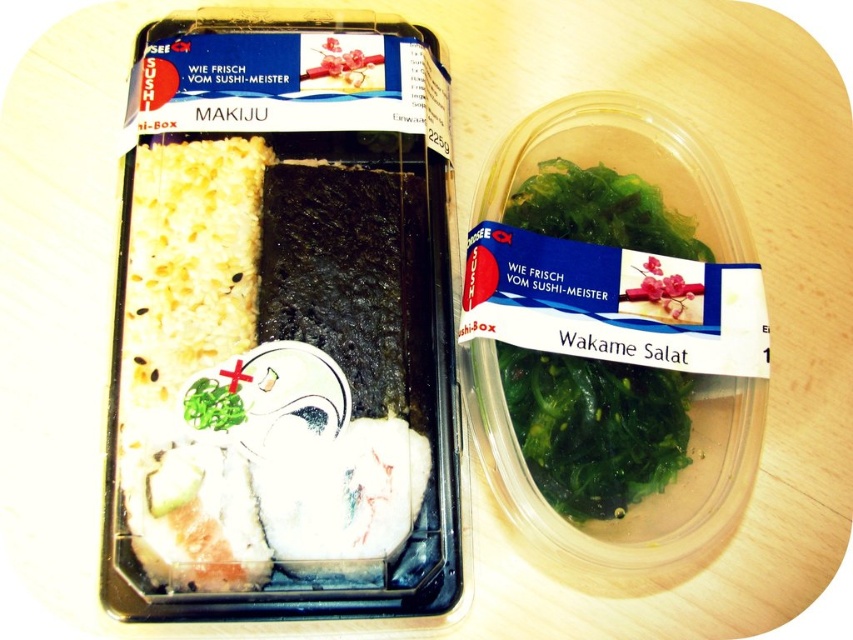
You are a food delivery person who needs to place a new order between the white rice at left and the green leafy seaweed at center. The new order requires a space of 12 inches. Can you fit it there?

The distance between the white rice at left and the green leafy seaweed at center is 13.39 inches. Since the required space is 12 inches, which is less than the available distance, the new order can be placed between them.

You are a delivery person holding a 1.5 meter long pole and need to pass through a narrow hallway. The hallway has a green leafy seaweed at center hanging from the ceiling. Can your pole fit through without touching the seaweed?

The distance between the green leafy seaweed at center and the camera is 1.28 meters. Since the pole is 1.5 meters long, it would extend beyond the seaweed, so the pole cannot fit through without touching the seaweed.